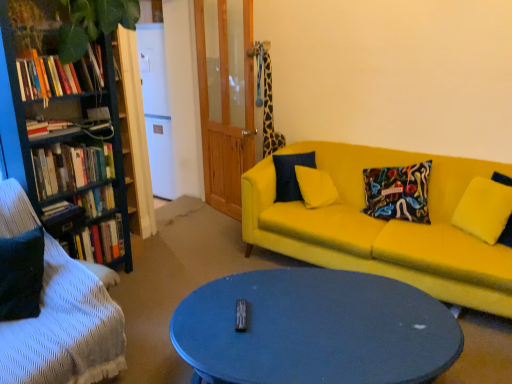
Question: Considering the positions of hardcover books at left, positioned as the fourth book in bottom-to-top order, and matte blue coffee table at center in the image, is hardcover books at left, positioned as the fourth book in bottom-to-top order, wider or thinner than matte blue coffee table at center?

Choices:
 (A) wide
 (B) thin

Answer: (B)

Question: In terms of size, does hardcover books at left, positioned as the fourth book in bottom-to-top order, appear bigger or smaller than matte blue coffee table at center?

Choices:
 (A) big
 (B) small

Answer: (B)

Question: Which object is the closest to the hardcover books at left, which is the 2th book in top-to-bottom order?

Choices:
 (A) wooden bookshelf at left
 (B) velvet black studio couch at lower left, which is the 2th studio couch from right to left
 (C) matte blue coffee table at center
 (D) hardcover book at left, which appears as the fifth book when viewed from the top
 (E) yellow fabric couch at center, the 2th studio couch viewed from the left

Answer: (A)

Question: Based on their relative distances, which object is nearer to the hardcover books at left, acting as the fifth book starting from the bottom?

Choices:
 (A) hardcover book at left, placed as the 2th book when sorted from bottom to top
 (B) yellow fabric pillow at right
 (C) wooden bookshelf at left
 (D) hardcover books at left, the third book when ordered from top to bottom
 (E) hardcover books at left, which is the 2th book in top-to-bottom order

Answer: (C)